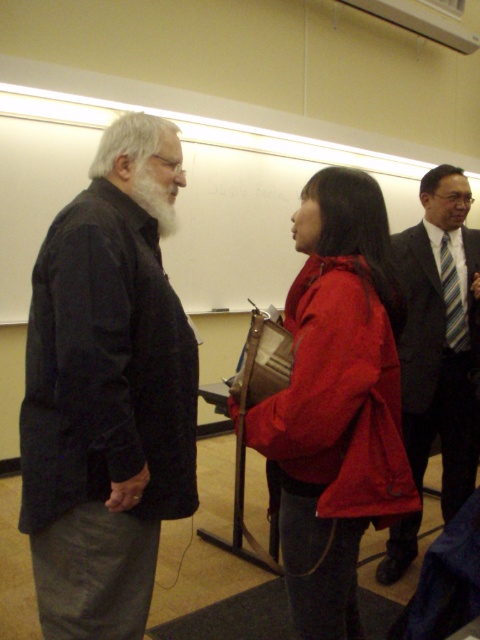
You are organizing a photo shoot and need to place a small prop between the matte red jacket at center and the dark gray suit at right. Given their sizes, which object should the prop be placed closer to?

The prop should be placed closer to the matte red jacket at center because it is smaller than the dark gray suit at right, allowing for better spatial balance.

You are an interior designer assessing the classroom layout. You notice the matte red jacket at center and the whitehairbeard at left. Which object occupies more visual space in the scene?

The matte red jacket at center is bigger than the whitehairbeard at left, so it occupies more visual space in the scene.